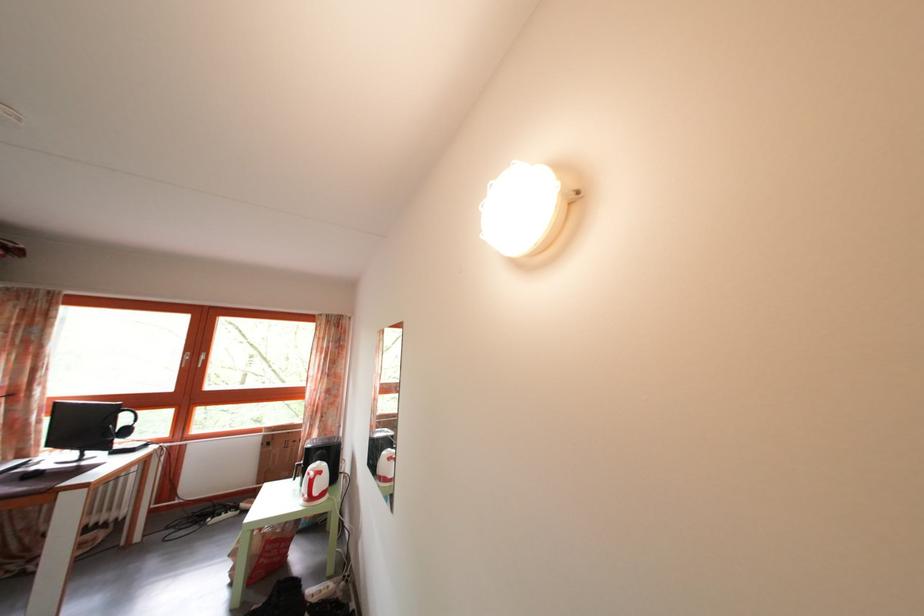
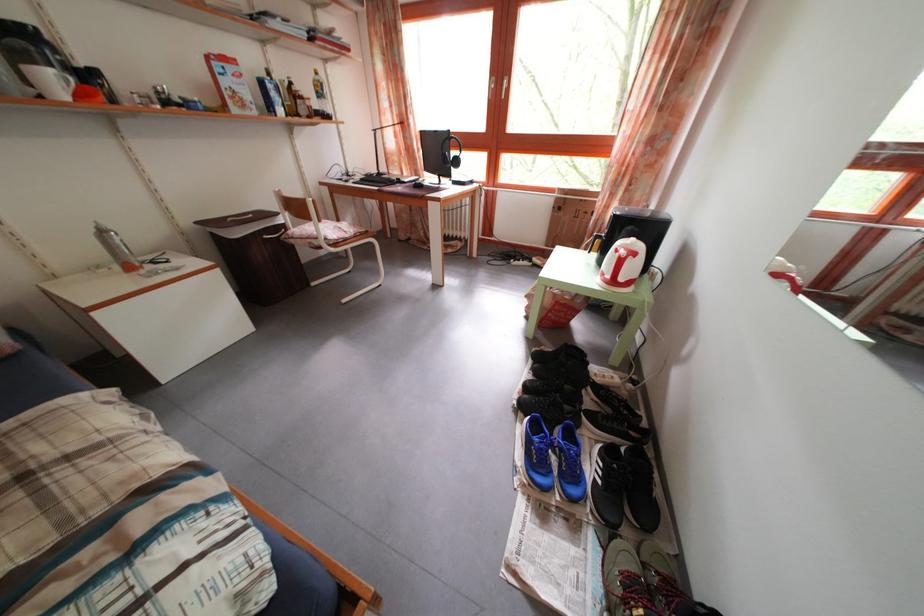
Locate, in the second image, the point that corresponds to (x=99, y=429) in the first image.

(446, 160)